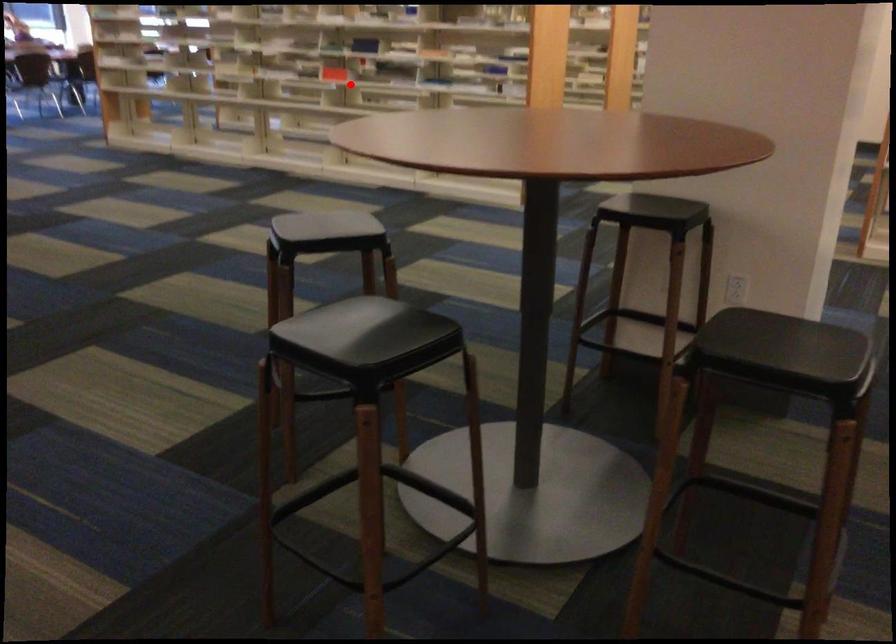
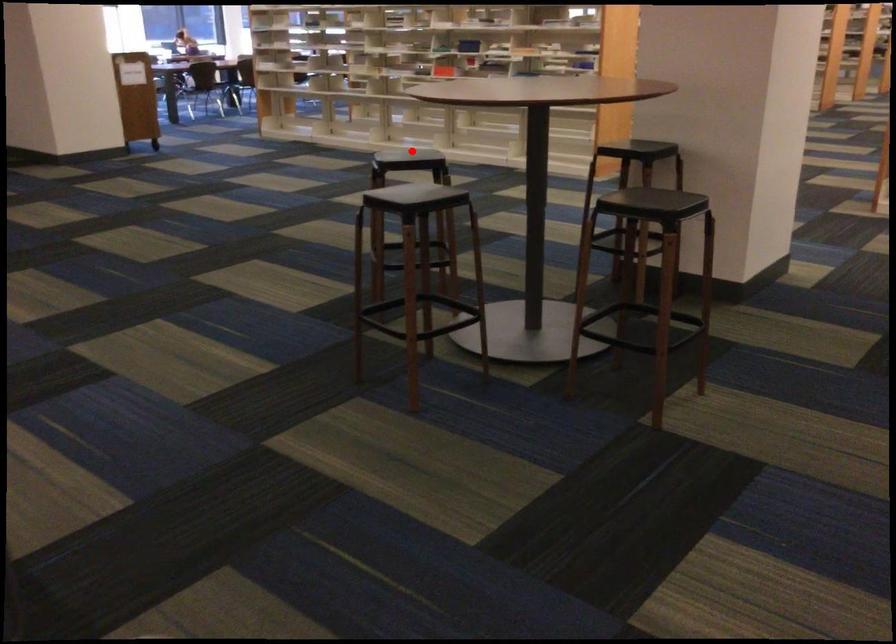
I am providing you with two images of the same scene from different viewpoints. A red point is marked on the first image and another point is marked on the second image. Is the red point in image1 aligned with the point shown in image2?

No